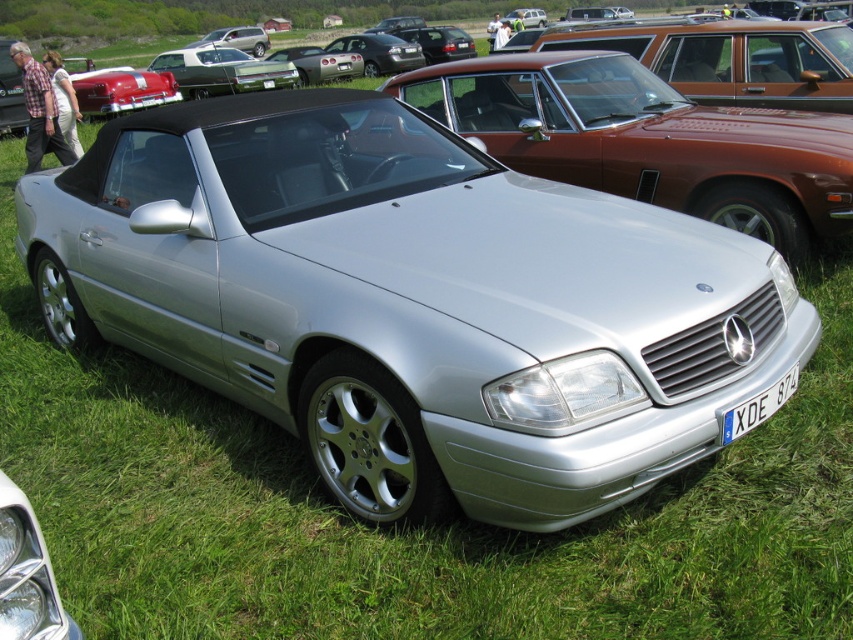
Question: Estimate the real-world distances between objects in this image. Which object is closer to the silver metallic convertible at center?

Choices:
 (A) shiny silver convertible at center
 (B) blue metallic license plate at bottom center
 (C) matte brown station wagon at upper center
 (D) satin silver metallic car at upper center

Answer: (C)

Question: Can you confirm if silver metallic convertible at center is positioned to the right of matte brown station wagon at upper center?

Choices:
 (A) no
 (B) yes

Answer: (A)

Question: Which object is farther from the camera taking this photo?

Choices:
 (A) silver metallic convertible at center
 (B) satin silver metallic car at upper center

Answer: (B)

Question: Which object is farther from the camera taking this photo?

Choices:
 (A) matte brown station wagon at upper center
 (B) satin silver metallic car at upper center

Answer: (B)

Question: Is matte brown station wagon at upper center to the right of blue metallic license plate at bottom center from the viewer's perspective?

Choices:
 (A) yes
 (B) no

Answer: (A)

Question: Does silver metallic convertible at center have a greater width compared to shiny silver convertible at center?

Choices:
 (A) yes
 (B) no

Answer: (B)